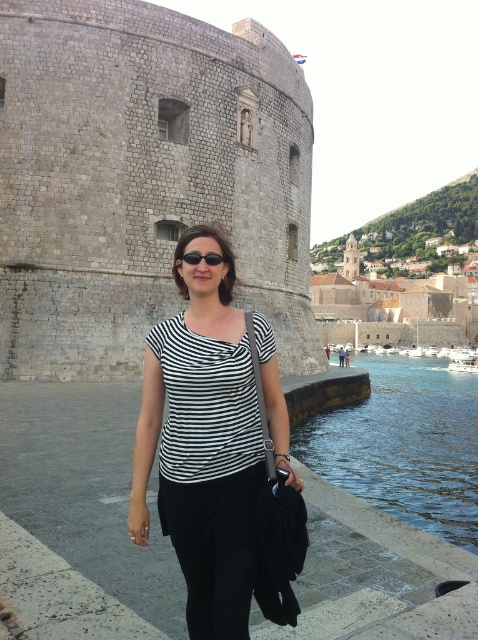
Question: Is gray stone castle at center thinner than black plastic sunglasses at center?

Choices:
 (A) no
 (B) yes

Answer: (A)

Question: Does gray stone castle at center appear under black striped shirt at center?

Choices:
 (A) no
 (B) yes

Answer: (A)

Question: Among these objects, which one is nearest to the camera?

Choices:
 (A) black plastic sunglasses at center
 (B) gray stone castle at center
 (C) black striped shirt at center
 (D) clear blue water at lower right

Answer: (C)

Question: Which object appears closest to the camera in this image?

Choices:
 (A) clear blue water at lower right
 (B) black striped shirt at center
 (C) black plastic sunglasses at center
 (D) gray stone castle at center

Answer: (B)

Question: Which point is closer to the camera?

Choices:
 (A) black plastic sunglasses at center
 (B) black striped shirt at center

Answer: (B)

Question: Does black striped shirt at center appear under black plastic sunglasses at center?

Choices:
 (A) no
 (B) yes

Answer: (B)